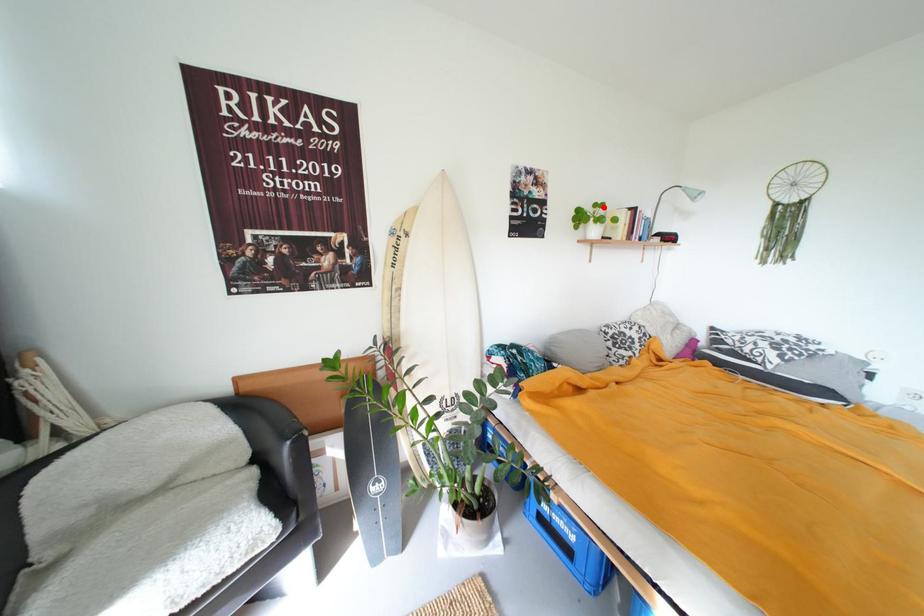
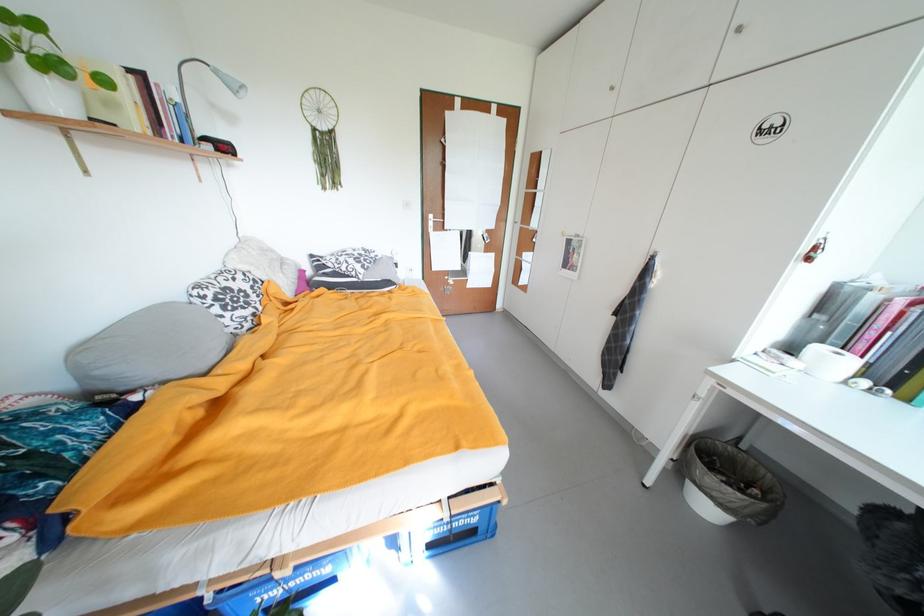
Question: I am providing you with two images of the same scene from different viewpoints. Given a red point in image1, look at the same physical point in image2. Is it:

Choices:
 (A) Closer to the viewpoint
 (B) Farther from the viewpoint

Answer: (B)